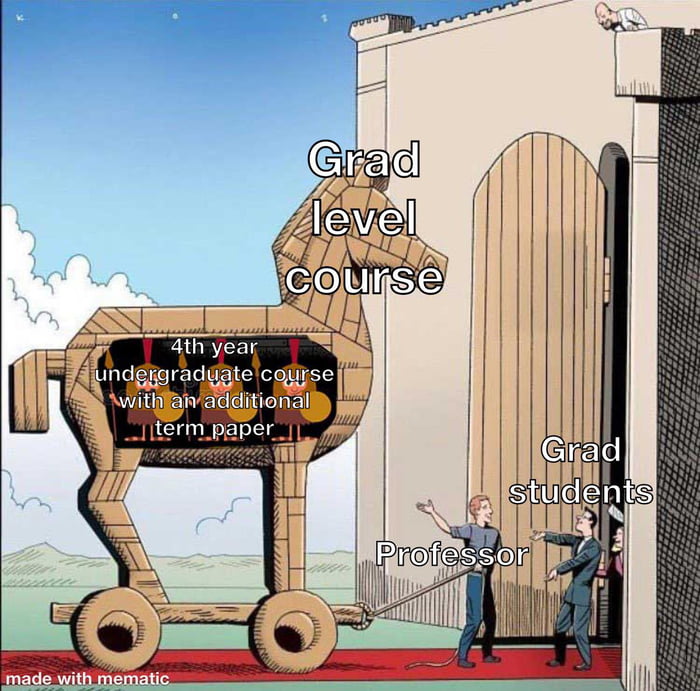
Locate an element on the screen. red carpet is located at coordinates (379, 651).